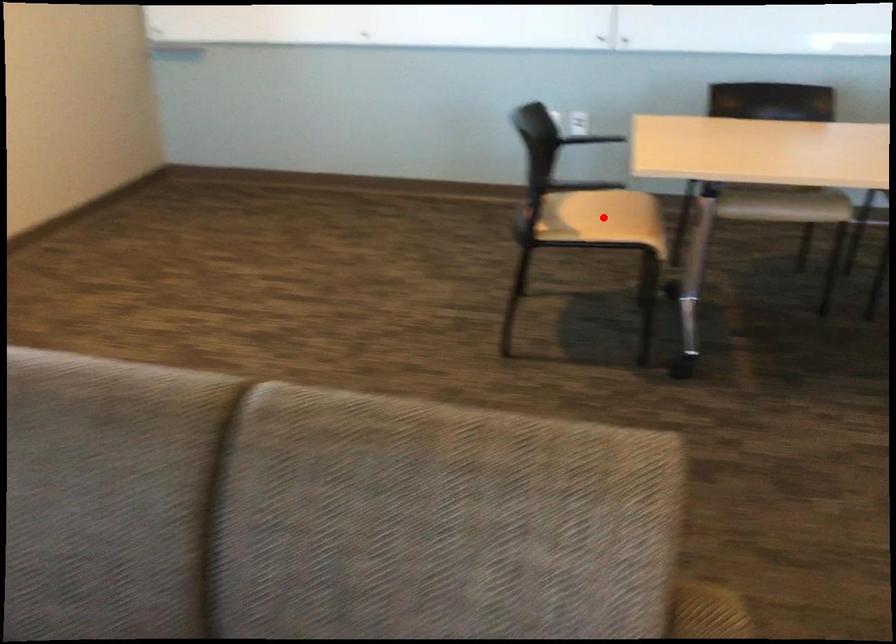
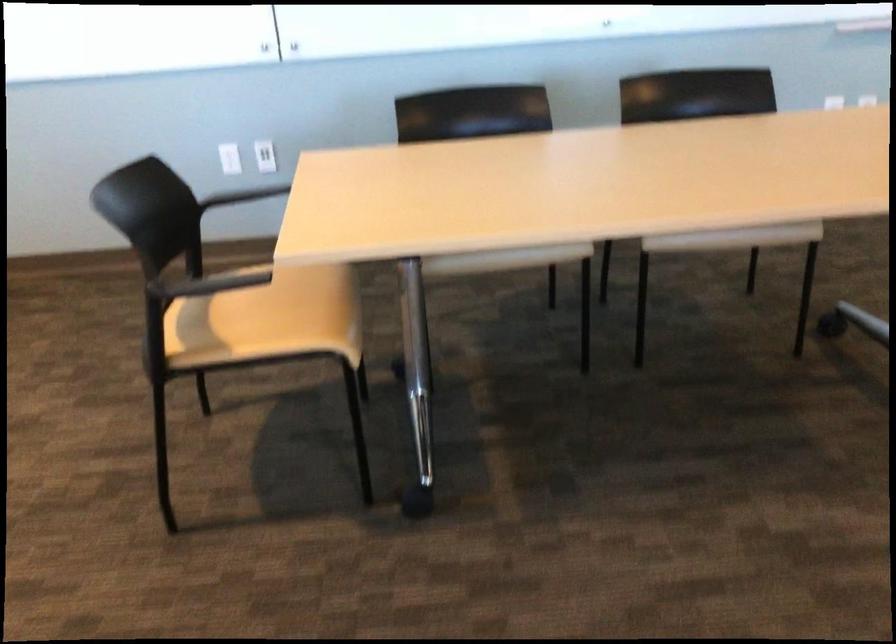
Question: I am providing you with two images of the same scene from different viewpoints. Given a red point in image1, look at the same physical point in image2. Is it:

Choices:
 (A) Closer to the viewpoint
 (B) Farther from the viewpoint

Answer: (A)